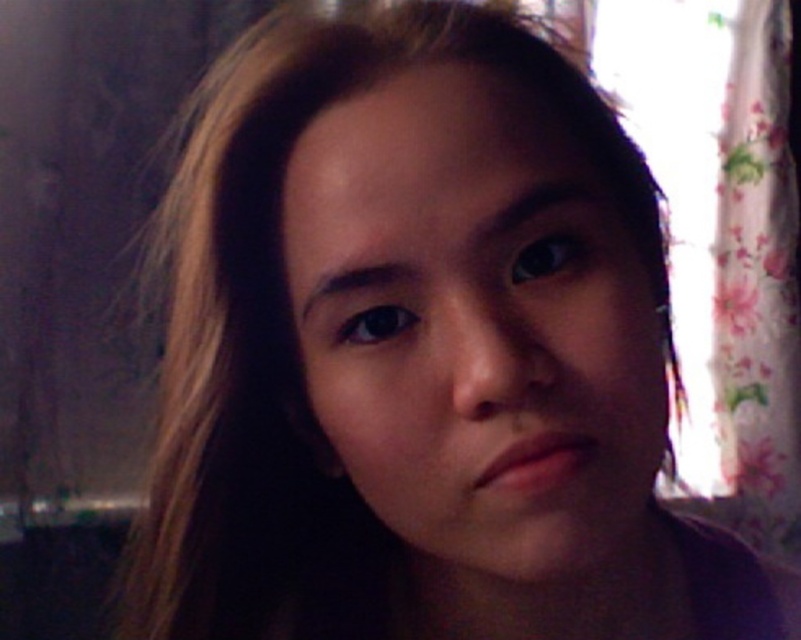
Based on the scene description, where is the smooth skin face at center located in terms of coordinates?

The smooth skin face at center is located at coordinates point (475, 324).

You are taking a photo of a person with a camera that has a limited depth of field. You want to ensure that both the point at coordinates point (409, 548) and point (763, 45) are in focus. Given that the camera can only focus on one point, which point should you focus on to maximize the chances of both points being in focus?

You should focus on point (763, 45) because it is further away from the camera than point (409, 548). By focusing on the further point, the depth of field will extend backward, potentially keeping both points in focus.